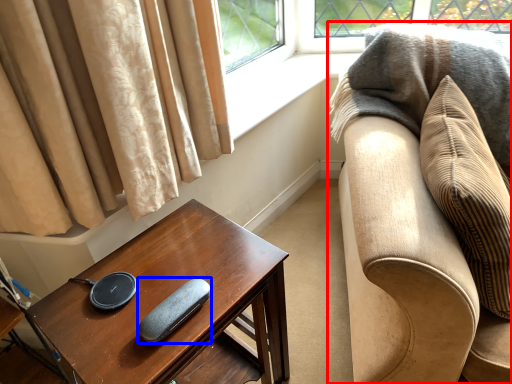
Question: Among these objects, which one is nearest to the camera, studio couch (highlighted by a red box) or pad (highlighted by a blue box)?

Choices:
 (A) studio couch
 (B) pad

Answer: (A)